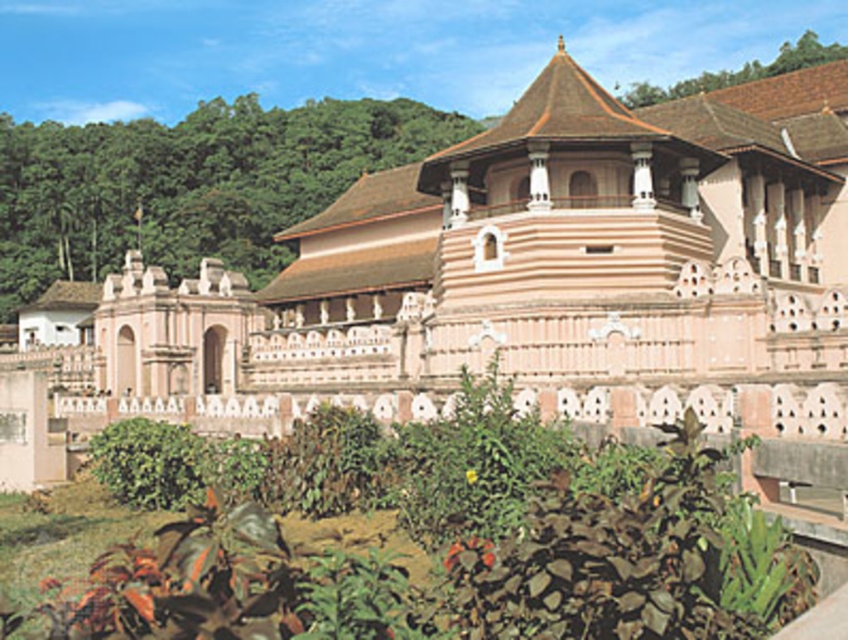
Question: Can you confirm if pink stone palace at center is positioned above green leafy shrub at left?

Choices:
 (A) no
 (B) yes

Answer: (A)

Question: Which object is farther from the camera taking this photo?

Choices:
 (A) pink stone palace at center
 (B) green leafy shrub at left

Answer: (B)

Question: Observing the image, what is the correct spatial positioning of pink stone palace at center in reference to green leafy plants at center?

Choices:
 (A) above
 (B) below

Answer: (A)

Question: Which object appears closest to the camera in this image?

Choices:
 (A) pink stone palace at center
 (B) green leafy plants at center
 (C) green leafy shrub at left

Answer: (B)

Question: Which point appears farthest from the camera in this image?

Choices:
 (A) (709, 186)
 (B) (215, 109)
 (C) (466, 481)

Answer: (B)

Question: Does pink stone palace at center appear over green leafy shrub at left?

Choices:
 (A) no
 (B) yes

Answer: (A)